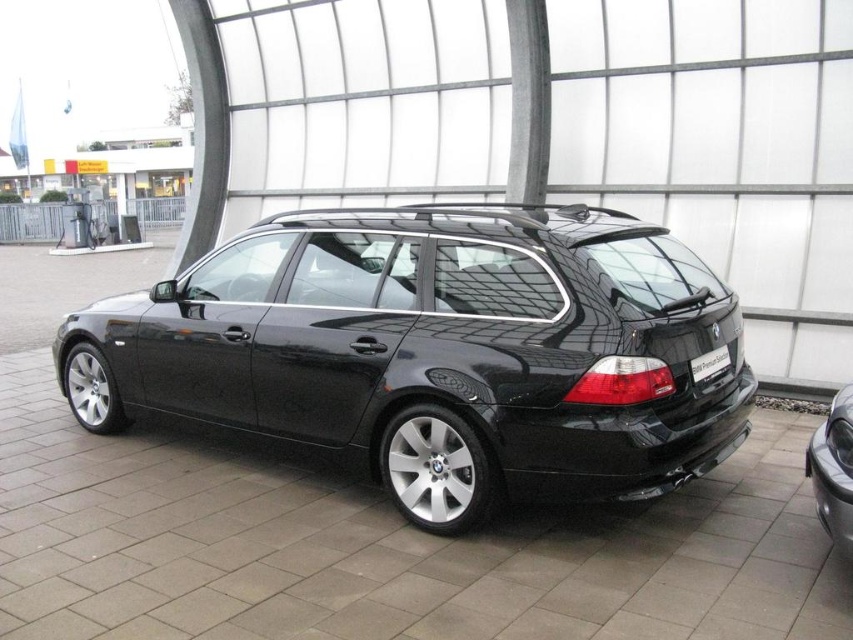
Question: Which point is closer to the camera taking this photo?

Choices:
 (A) (692, 369)
 (B) (253, 240)
 (C) (846, 486)

Answer: (C)

Question: Considering the real-world distances, which object is closest to the black plastic license plate at rear?

Choices:
 (A) glossy black car at center
 (B) satin black car at lower right

Answer: (B)

Question: Considering the relative positions of glossy black car at center and satin black car at lower right in the image provided, where is glossy black car at center located with respect to satin black car at lower right?

Choices:
 (A) below
 (B) above

Answer: (B)

Question: Does satin black car at lower right have a smaller size compared to black plastic license plate at rear?

Choices:
 (A) yes
 (B) no

Answer: (B)

Question: Among these points, which one is farthest from the camera?

Choices:
 (A) (831, 422)
 (B) (697, 378)
 (C) (509, 310)

Answer: (B)

Question: Observing the image, what is the correct spatial positioning of glossy black car at center in reference to black plastic license plate at rear?

Choices:
 (A) left
 (B) right

Answer: (A)